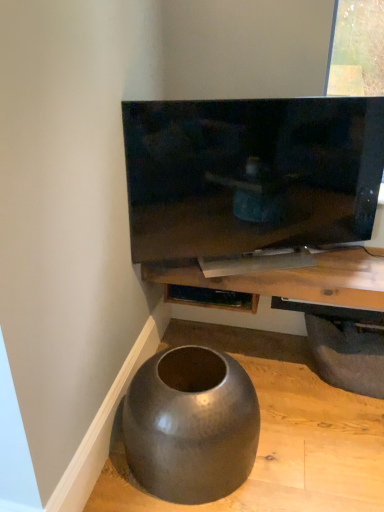
I want to click on vacant area to the left of dark gray rubber tire at lower right, so click(x=272, y=370).